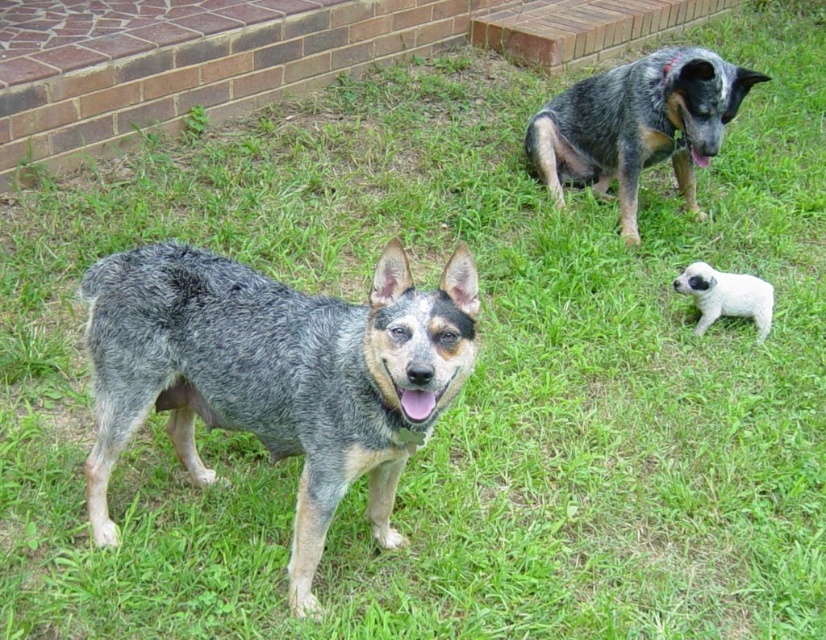
Between speckled fur dog at center and white fluffy puppy at lower right, which one has less height?

white fluffy puppy at lower right is shorter.

From the picture: Does speckled fur dog at center have a lesser width compared to white fluffy puppy at lower right?

No.

Does point (217, 396) lie behind point (758, 284)?

No, (217, 396) is in front of (758, 284).

The image size is (826, 640). I want to click on speckled fur dog at center, so click(x=276, y=376).

Can you confirm if speckled fur dog at upper right is wider than white fluffy puppy at lower right?

Yes, speckled fur dog at upper right is wider than white fluffy puppy at lower right.

The image size is (826, 640). What are the coordinates of `speckled fur dog at upper right` in the screenshot? It's located at (637, 125).

Between speckled fur dog at center and speckled fur dog at upper right, which one has more height?

speckled fur dog at center

Does speckled fur dog at center appear on the right side of speckled fur dog at upper right?

No, speckled fur dog at center is not to the right of speckled fur dog at upper right.

This screenshot has height=640, width=826. What are the coordinates of `speckled fur dog at center` in the screenshot? It's located at (276, 376).